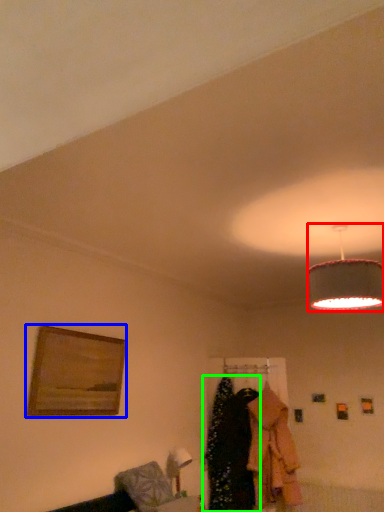
Question: Which is farther away from lamp (highlighted by a red box)? picture frame (highlighted by a blue box) or clothing (highlighted by a green box)?

Choices:
 (A) picture frame
 (B) clothing

Answer: (B)